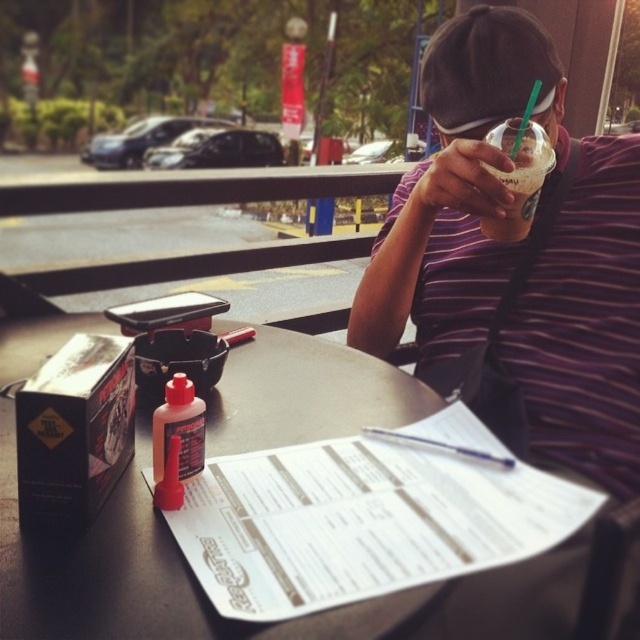
Question: Can you confirm if purple striped shirt at upper right is positioned to the right of translucent plastic cup at upper right?

Choices:
 (A) yes
 (B) no

Answer: (B)

Question: Which object appears farthest from the camera in this image?

Choices:
 (A) purple striped shirt at upper right
 (B) smooth black table at center

Answer: (A)

Question: Does purple striped shirt at upper right appear on the left side of translucent plastic cup at upper right?

Choices:
 (A) no
 (B) yes

Answer: (B)

Question: Which point is farther from the camera taking this photo?

Choices:
 (A) (580, 275)
 (B) (122, 534)

Answer: (A)

Question: Can you confirm if purple striped shirt at upper right is positioned to the right of translucent plastic cup at upper right?

Choices:
 (A) no
 (B) yes

Answer: (A)

Question: Estimate the real-world distances between objects in this image. Which object is farther from the purple striped shirt at upper right?

Choices:
 (A) smooth black table at center
 (B) translucent plastic cup at upper right

Answer: (A)